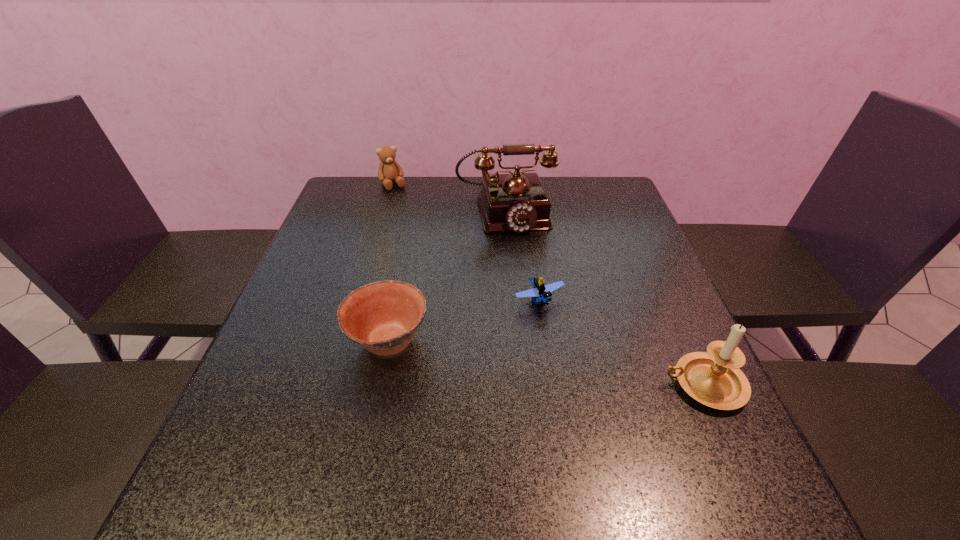
In the image, there is a desktop. Where is `free space at the far right corner`? The height and width of the screenshot is (540, 960). free space at the far right corner is located at coordinates (594, 176).

Where is `unoccupied position between the bowl and the telephone`? The height and width of the screenshot is (540, 960). unoccupied position between the bowl and the telephone is located at coordinates (446, 276).

Find the location of a particular element. The image size is (960, 540). free space between the tallest object and the fourth shortest object is located at coordinates (604, 298).

Where is `vacant space that's between the third tallest object and the Lego`? The height and width of the screenshot is (540, 960). vacant space that's between the third tallest object and the Lego is located at coordinates (467, 242).

Identify the location of vacant space that is in between the teddy bear and the bowl. (391, 262).

Where is `unoccupied position between the tallest object and the third tallest object`? unoccupied position between the tallest object and the third tallest object is located at coordinates 449,198.

The image size is (960, 540). In order to click on free space between the second tallest object and the telephone in this screenshot , I will do `click(604, 298)`.

Locate an element on the screen. free space between the second tallest object and the fourth tallest object is located at coordinates (545, 362).

At what (x,y) coordinates should I click in order to perform the action: click on vacant space in between the tallest object and the candle holder. Please return your answer as a coordinate pair (x, y). Looking at the image, I should click on coord(604,298).

Locate an element on the screen. This screenshot has width=960, height=540. vacant area that lies between the bowl and the shortest object is located at coordinates (464, 321).